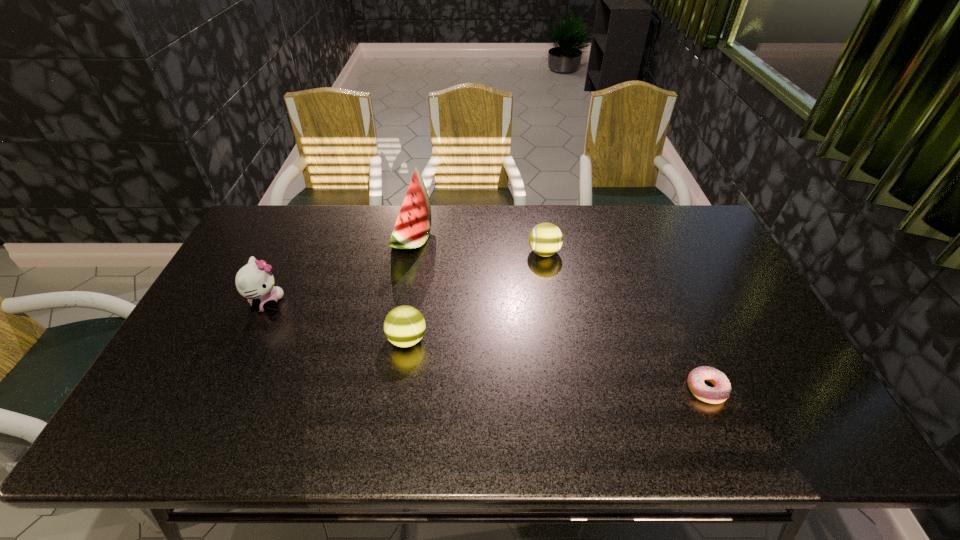
In the image, there is a desktop. Identify the location of free region at the right edge. Image resolution: width=960 pixels, height=540 pixels. (775, 370).

Where is `vacant region at the near left corner of the desktop`? This screenshot has height=540, width=960. vacant region at the near left corner of the desktop is located at coordinates (144, 421).

The image size is (960, 540). I want to click on free space at the far right corner, so click(660, 220).

This screenshot has height=540, width=960. Find the location of `vacant space in between the tallest object and the doughnut`. vacant space in between the tallest object and the doughnut is located at coordinates [559, 313].

Where is `vacant space in between the watermelon and the kitten`? The image size is (960, 540). vacant space in between the watermelon and the kitten is located at coordinates click(339, 271).

At what (x,y) coordinates should I click in order to perform the action: click on free space that is in between the left tennis ball and the farther tennis ball. Please return your answer as a coordinate pair (x, y). Looking at the image, I should click on (475, 296).

Locate an element on the screen. free space between the nearer tennis ball and the tallest object is located at coordinates (409, 288).

At what (x,y) coordinates should I click in order to perform the action: click on vacant region between the nearest object and the farther tennis ball. Please return your answer as a coordinate pair (x, y). Looking at the image, I should click on 625,321.

The image size is (960, 540). In order to click on vacant space that is in between the fourth shortest object and the right tennis ball in this screenshot , I will do point(405,278).

Where is `vacant space that's between the fourth shortest object and the left tennis ball`? This screenshot has height=540, width=960. vacant space that's between the fourth shortest object and the left tennis ball is located at coordinates (337, 321).